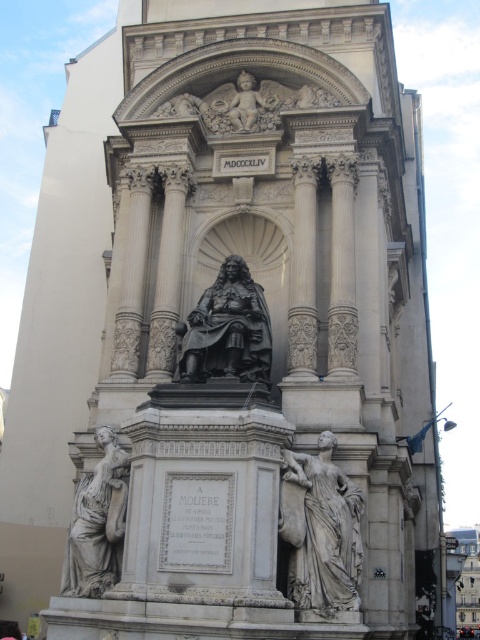
You are standing at the base of the monument and want to take a photo of the point at coordinates [292,472]. Given that the point is 48.04 meters away from the camera, is it possible to capture the entire monument in one frame without zooming?

The point at coordinates [292,472] is 48.04 meters away from the camera. Since the monument is grand and classical with intricate details, capturing the entire structure in one frame without zooming may be challenging due to the distance. However, the exact possibility depends on the camera lens and sensor size, which are not specified here.

From the picture: You are an art student observing the monument. You need to determine which object is taller between the black polished stone statue at center and the matte stone cherub at upper center. Based on the scene, which one is taller?

The black polished stone statue at center is taller than the matte stone cherub at upper center according to the description.